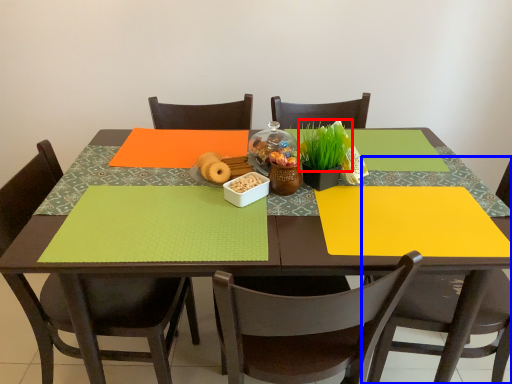
Question: Which of the following is the farthest to the observer, plant (highlighted by a red box) or chair (highlighted by a blue box)?

Choices:
 (A) plant
 (B) chair

Answer: (A)